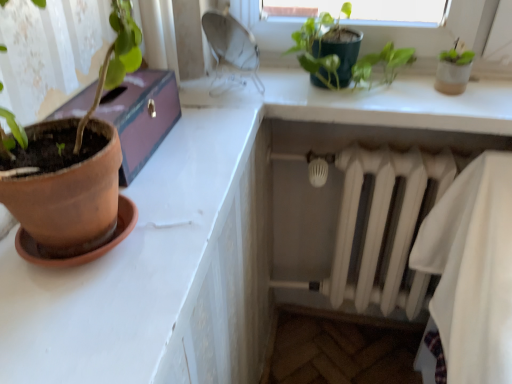
This screenshot has width=512, height=384. What are the coordinates of `free region under green matte plant at upper center (from a real-world perspective)` in the screenshot? It's located at (x=357, y=88).